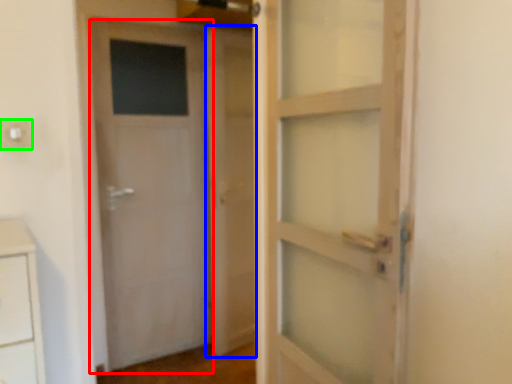
Question: Which object is the closest to the door (highlighted by a red box)? Choose among these: barn door (highlighted by a blue box) or electric outlet (highlighted by a green box).

Choices:
 (A) barn door
 (B) electric outlet

Answer: (A)